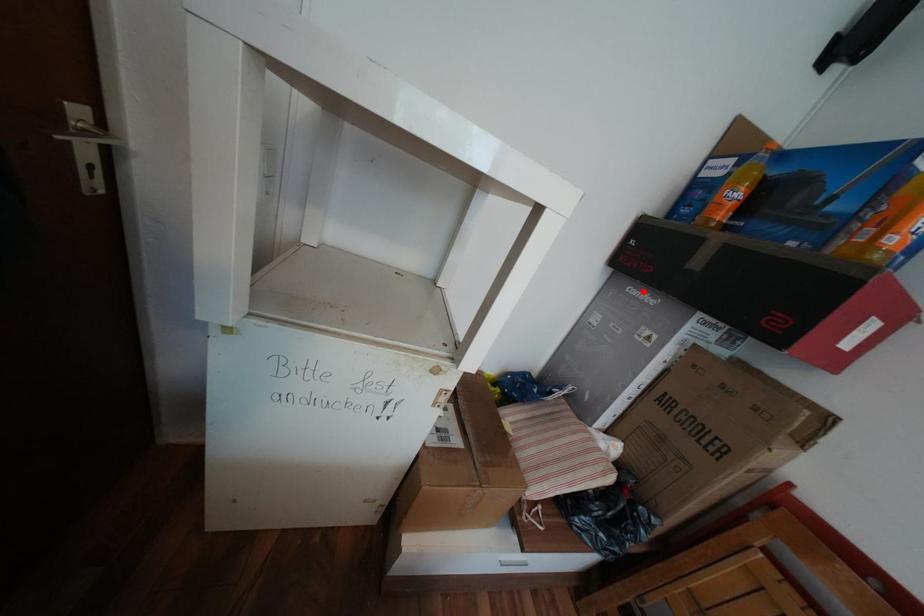
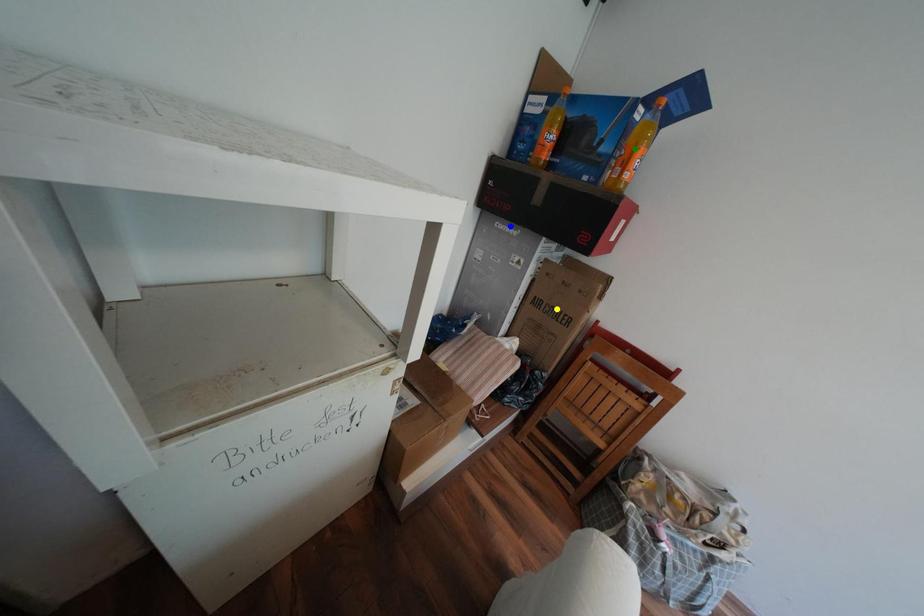
Question: I am providing you with two images of the same scene from different viewpoints. A red point is marked on the first image. You are given multiple points on the second image. In image 2, which mark is for the same physical point as the one in image 1?

Choices:
 (A) yellow point
 (B) blue point
 (C) green point

Answer: (B)